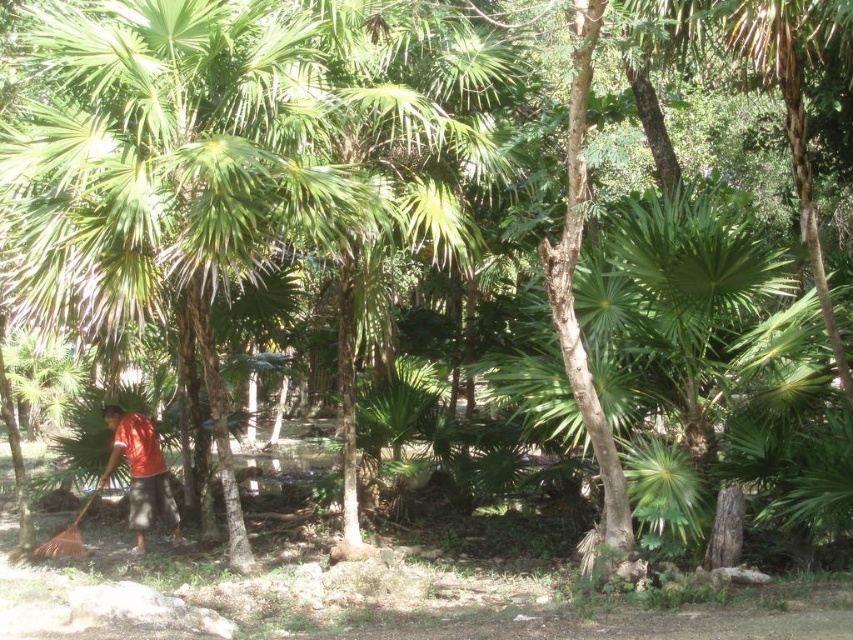
Between point (140, 461) and point (51, 548), which one is positioned in front?

Point (51, 548) is more forward.

Can you confirm if orange fabric shirt at lower left is shorter than brown wooden shovel at lower left?

No.

You are a GUI agent. You are given a task and a screenshot of the screen. Output one action in this format:
    pyautogui.click(x=<x>, y=<y>)
    Task: Click on the orange fabric shirt at lower left
    
    Given the screenshot: What is the action you would take?
    pyautogui.click(x=140, y=472)